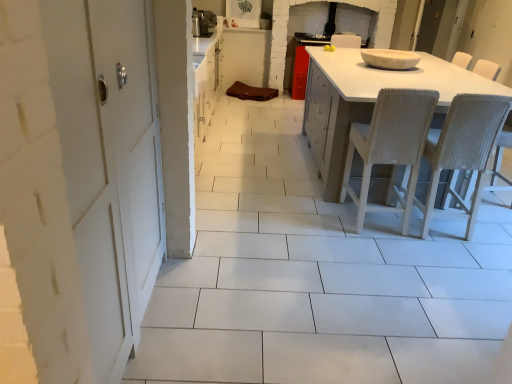
Question: Is point (365, 94) positioned closer to the camera than point (482, 125)?

Choices:
 (A) closer
 (B) farther

Answer: (B)

Question: In terms of width, does white matte table at right look wider or thinner when compared to white woven chair at right, the first chair viewed from the right?

Choices:
 (A) thin
 (B) wide

Answer: (B)

Question: Which is farther from the white matte table at right?

Choices:
 (A) metallic silver toaster at upper center, the 1th appliance when ordered from top to bottom
 (B) white woven chair at right, the first chair viewed from the right
 (C) white matte door at left
 (D) white glossy bowl at center, the second appliance when ordered from back to front
 (E) brown fabric at center

Answer: (E)

Question: Which is nearer to the metallic silver toaster at upper center, the 1th appliance when ordered from top to bottom?

Choices:
 (A) white glossy bowl at center, the first appliance in the right-to-left sequence
 (B) white matte door at left
 (C) white matte table at right
 (D) white woven chair at right, the first chair viewed from the right
 (E) brown fabric at center

Answer: (E)